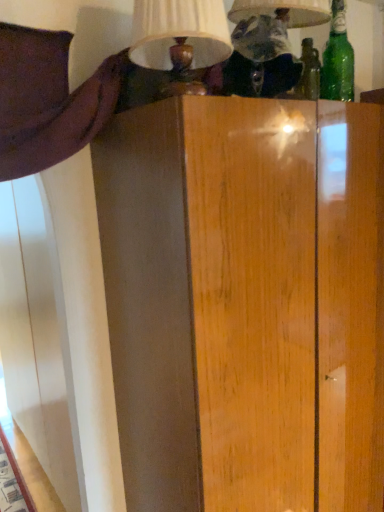
Question: From the image's perspective, is matte white lampshade at upper center, placed as the first table lamp when sorted from right to left, above or below matte cream lampshade at upper center, placed as the second table lamp when sorted from right to left?

Choices:
 (A) below
 (B) above

Answer: (B)

Question: In terms of height, does matte white lampshade at upper center, placed as the first table lamp when sorted from right to left, look taller or shorter compared to matte cream lampshade at upper center, marked as the 1th table lamp in a left-to-right arrangement?

Choices:
 (A) short
 (B) tall

Answer: (B)

Question: Considering the real-world distances, which object is farthest from the matte cream lampshade at upper center, marked as the 1th table lamp in a left-to-right arrangement?

Choices:
 (A) green glass bottle at upper right
 (B) matte white lampshade at upper center, positioned as the 2th table lamp in left-to-right order

Answer: (A)

Question: Which object is positioned farthest from the green glass bottle at upper right?

Choices:
 (A) matte white lampshade at upper center, placed as the first table lamp when sorted from right to left
 (B) matte cream lampshade at upper center, placed as the second table lamp when sorted from right to left

Answer: (B)